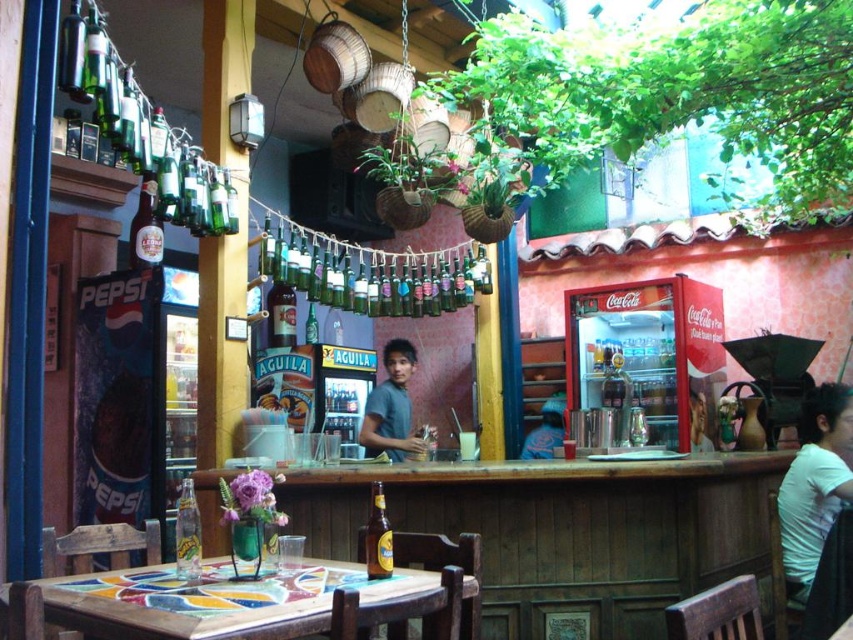
Can you confirm if wooden mosaic table at center is shorter than smooth blue shirt at center?

Yes.

In order to click on wooden mosaic table at center in this screenshot , I will do `click(253, 604)`.

Image resolution: width=853 pixels, height=640 pixels. In order to click on wooden mosaic table at center in this screenshot , I will do `click(253, 604)`.

Identify the location of wooden mosaic table at center. (253, 604).

Is golden glass bottle at center thinner than blue denim jacket at center?

Yes, golden glass bottle at center is thinner than blue denim jacket at center.

Is point (370, 504) positioned before point (555, 403)?

Yes, point (370, 504) is in front of point (555, 403).

The width and height of the screenshot is (853, 640). I want to click on golden glass bottle at center, so click(378, 538).

What are the coordinates of `golden glass bottle at center` in the screenshot? It's located at (378, 538).

Who is taller, translucent glass bottle at table center or golden glass bottle at center?

golden glass bottle at center is taller.

Is translucent glass bottle at table center smaller than golden glass bottle at center?

Incorrect, translucent glass bottle at table center is not smaller in size than golden glass bottle at center.

Find the location of a particular element. The width and height of the screenshot is (853, 640). translucent glass bottle at table center is located at coordinates (187, 532).

I want to click on translucent glass bottle at table center, so click(187, 532).